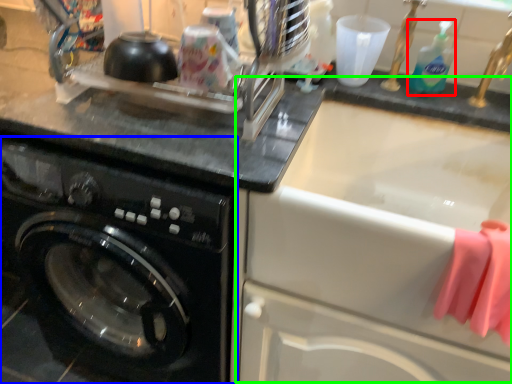
Question: Considering the real-world distances, which object is farthest from cleaning product (highlighted by a red box)? washing machine (highlighted by a blue box) or sink (highlighted by a green box)?

Choices:
 (A) washing machine
 (B) sink

Answer: (A)